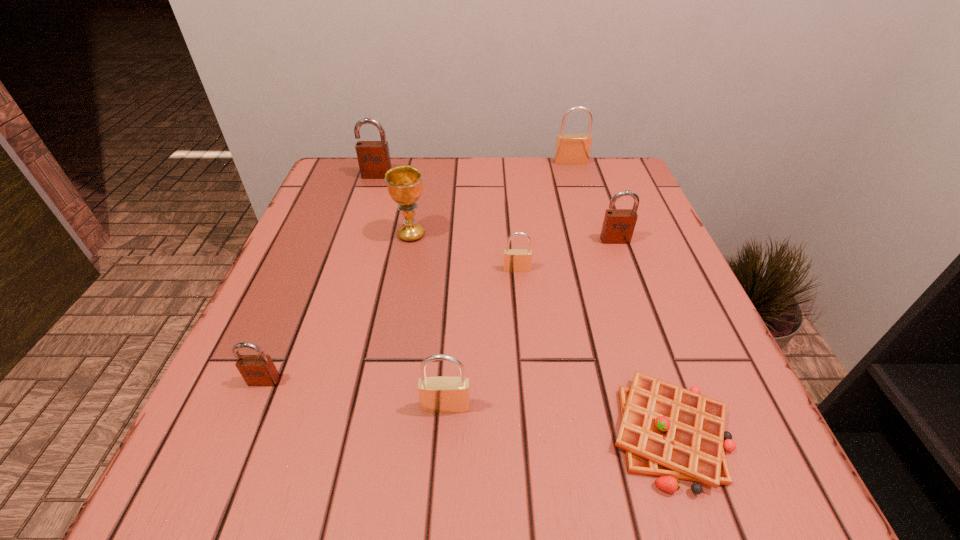
The height and width of the screenshot is (540, 960). Find the location of `vacant area situated 0.200m on the front-facing side of the fourth farthest padlock`. vacant area situated 0.200m on the front-facing side of the fourth farthest padlock is located at coordinates (525, 356).

Locate an element on the screen. vacant area located on the front-facing side of the leftmost object is located at coordinates (238, 443).

Locate an element on the screen. vacant space located on the back of the waffle is located at coordinates (616, 274).

Where is `object located at the near edge`? The width and height of the screenshot is (960, 540). object located at the near edge is located at coordinates (667, 431).

I want to click on waffle at the right edge, so click(667, 431).

The image size is (960, 540). I want to click on object located in the far left corner section of the desktop, so click(373, 157).

Locate an element on the screen. The width and height of the screenshot is (960, 540). object at the far right corner is located at coordinates (571, 149).

The image size is (960, 540). Find the location of `object located at the near right corner`. object located at the near right corner is located at coordinates (667, 431).

Image resolution: width=960 pixels, height=540 pixels. In the image, there is a desktop. In order to click on vacant space at the far edge in this screenshot , I will do `click(457, 206)`.

Locate an element on the screen. This screenshot has height=540, width=960. free location at the near edge is located at coordinates (513, 477).